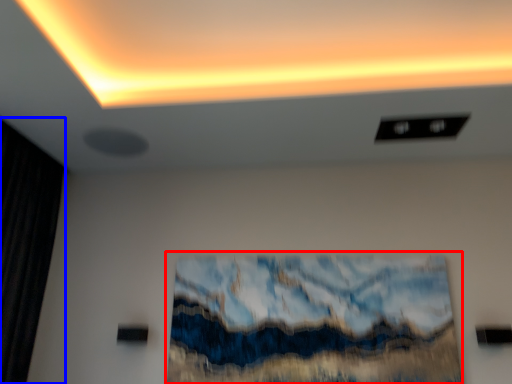
Question: Which object appears closest to the camera in this image, oil painting (highlighted by a red box) or curtain (highlighted by a blue box)?

Choices:
 (A) oil painting
 (B) curtain

Answer: (B)